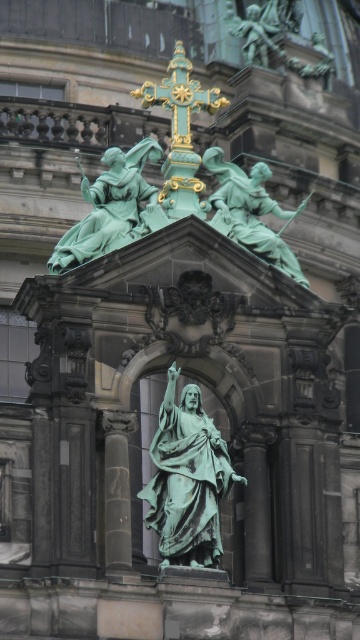
You are standing in front of the grand architectural structure and want to take a photo of both the green patina statue at center and the green patinated statue at upper center. Which statue will appear larger in your photo?

The green patina statue at center will appear larger in the photo because it is closer to the viewer than the green patinated statue at upper center.

You are an art student analyzing the composition of this religious artwork. Given the placement and size of the green patina statue at center and the goldmetalliccross at upper center, which object appears larger in the artwork?

The goldmetalliccross at upper center appears larger than the green patina statue at center.